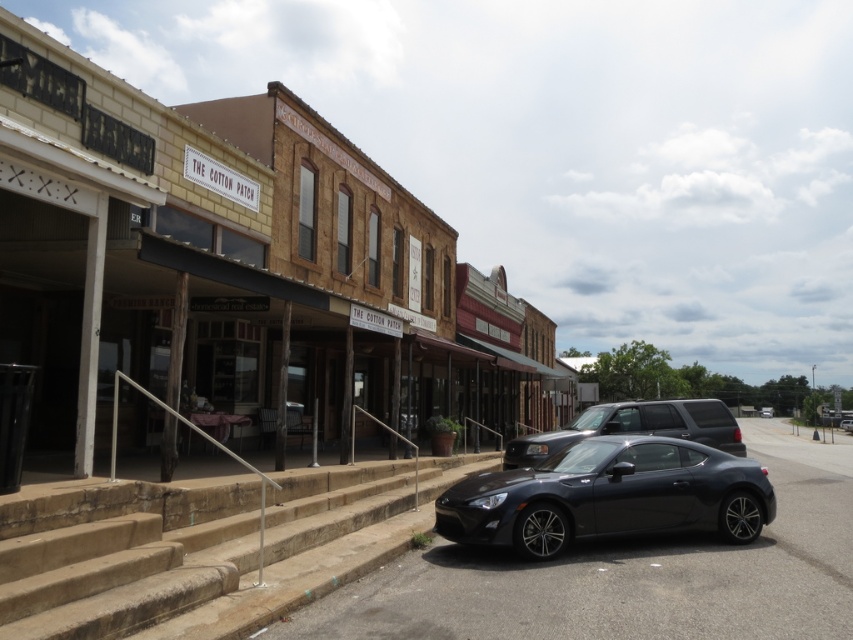
You are standing at the point labeled point (229,266) in the scene. Which building are you in front of?

You are in front of the matte brick building at center.

You are a delivery person trying to park your van between the matte brick building at center and the stone steps at center. Can you fit your van there if it requires 3 meters of space?

The matte brick building at center might be wider than stone steps at center, but without exact measurements, it is uncertain if the space between them is at least 3 meters. You should check the distance before attempting to park.

You are a tourist standing on the street and want to take a photo of the matte brick building at center and the stone steps at center. Which object should you position closer to the camera to ensure both are in the frame?

The matte brick building at center is positioned on the right side of stone steps at center, so you should position the stone steps at center closer to the camera to include both in the frame.